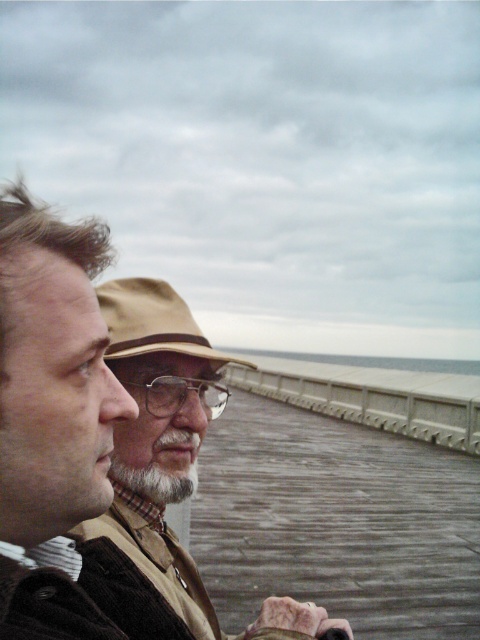
Does brown woolen sweater at center have a greater width compared to gray concrete rail at center?

In fact, brown woolen sweater at center might be narrower than gray concrete rail at center.

Who is lower down, brown woolen sweater at center or gray concrete rail at center?

gray concrete rail at center is below.

Which is behind, point (136, 301) or point (456, 385)?

The point (456, 385) is behind.

Identify the location of brown woolen sweater at center. The width and height of the screenshot is (480, 640). (160, 372).

Which is more to the left, brown woolen sweater at center or graywoollybeard at center?

graywoollybeard at center

Does point (146, 566) lie in front of point (143, 490)?

Yes, point (146, 566) is closer to viewer.

Image resolution: width=480 pixels, height=640 pixels. Find the location of `brown woolen sweater at center`. brown woolen sweater at center is located at coordinates (160, 372).

Does tan felt hat at center appear on the left side of graywoollybeard at center?

No, tan felt hat at center is not to the left of graywoollybeard at center.

Can you confirm if tan felt hat at center is wider than graywoollybeard at center?

Correct, the width of tan felt hat at center exceeds that of graywoollybeard at center.

At what (x,y) coordinates should I click in order to perform the action: click on tan felt hat at center. Please return your answer as a coordinate pair (x, y). Image resolution: width=480 pixels, height=640 pixels. Looking at the image, I should click on (153, 321).